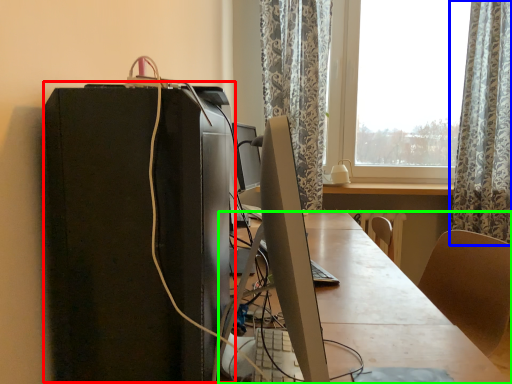
Question: Which is nearer to the computer tower (highlighted by a red box)? curtain (highlighted by a blue box) or desk (highlighted by a green box).

Choices:
 (A) curtain
 (B) desk

Answer: (B)